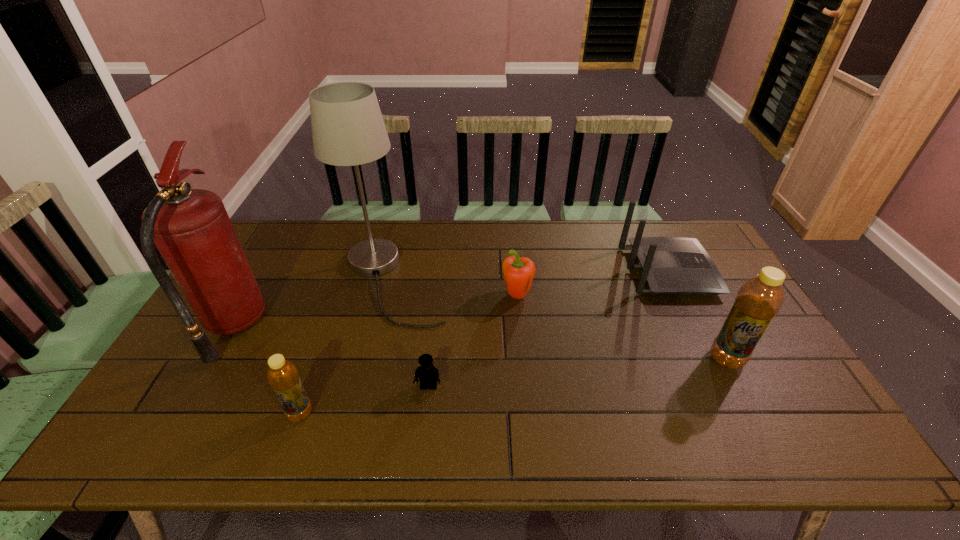
Identify the location of Lego. (427, 373).

Locate an element on the screen. The image size is (960, 540). blank space located 0.170m on the right of the left bottle is located at coordinates (384, 413).

Identify the location of vacant area situated on the back of the farther bottle. (709, 326).

Locate an element on the screen. vacant space situated on the right of the fifth object from left to right is located at coordinates (560, 296).

Locate an element on the screen. The image size is (960, 540). vacant space located on the front-facing side of the router is located at coordinates (728, 272).

Find the location of a particular element. This screenshot has height=540, width=960. free region located at the front of the leftmost object where the nozzle is aimed is located at coordinates (308, 326).

The image size is (960, 540). In order to click on free region located on the right of the table lamp in this screenshot , I will do `click(470, 281)`.

Image resolution: width=960 pixels, height=540 pixels. Find the location of `router at the far edge`. router at the far edge is located at coordinates (669, 265).

Where is `table lamp that is at the far edge`? The width and height of the screenshot is (960, 540). table lamp that is at the far edge is located at coordinates (348, 129).

At what (x,y) coordinates should I click in order to perform the action: click on bottle that is positioned at the near edge. Please return your answer as a coordinate pair (x, y). Looking at the image, I should click on (282, 375).